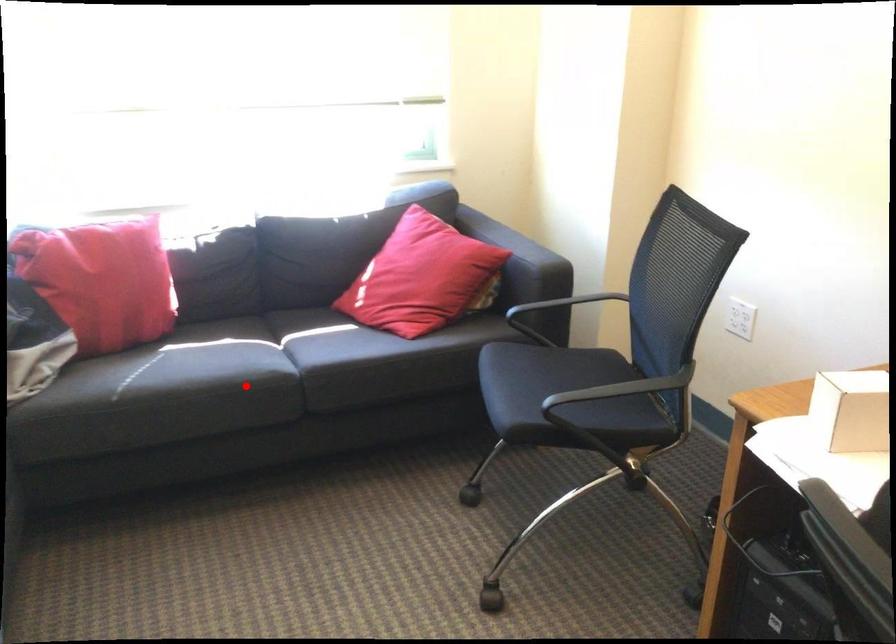
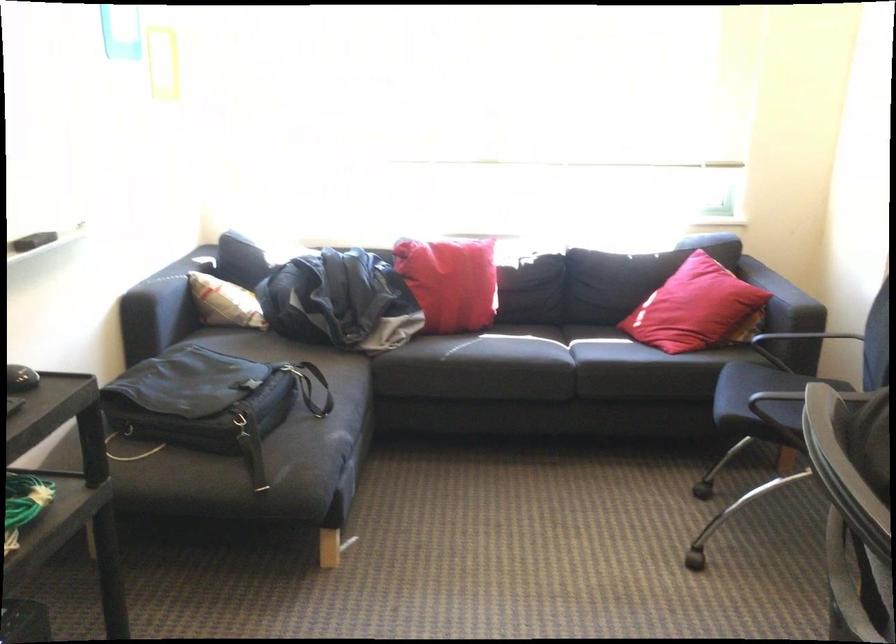
Where in the second image is the point corresponding to the highlighted location from the first image?

(535, 364)